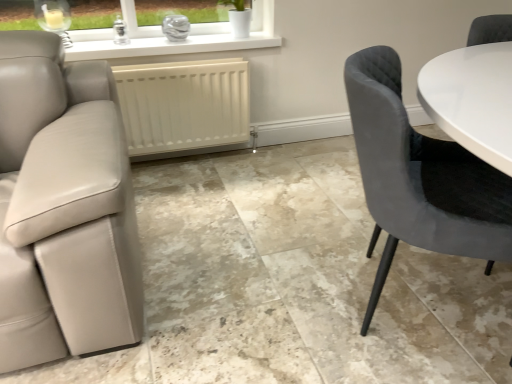
Where is `blank area to the left of velvet grey chair at right`? The image size is (512, 384). blank area to the left of velvet grey chair at right is located at coordinates (254, 292).